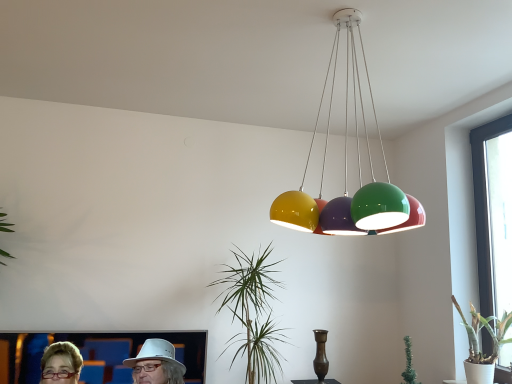
Question: In which direction should I rotate to look at green glossy plant at center, acting as the first houseplant starting from the left?

Choices:
 (A) left
 (B) right

Answer: (A)

Question: Does transparent glass window at right have a greater height compared to bronze metallic vase at center?

Choices:
 (A) yes
 (B) no

Answer: (A)

Question: Can you confirm if transparent glass window at right is thinner than bronze metallic vase at center?

Choices:
 (A) yes
 (B) no

Answer: (A)

Question: Is transparent glass window at right far away from bronze metallic vase at center?

Choices:
 (A) no
 (B) yes

Answer: (B)

Question: Does transparent glass window at right lie behind bronze metallic vase at center?

Choices:
 (A) no
 (B) yes

Answer: (A)

Question: Is transparent glass window at right outside bronze metallic vase at center?

Choices:
 (A) no
 (B) yes

Answer: (B)

Question: Is transparent glass window at right facing away from bronze metallic vase at center?

Choices:
 (A) no
 (B) yes

Answer: (A)

Question: Can you confirm if matte white hat at lower left is smaller than green glossy plant at center, acting as the first houseplant starting from the left?

Choices:
 (A) no
 (B) yes

Answer: (B)

Question: Are matte white hat at lower left and green glossy plant at center, which ranks as the 2th houseplant in right-to-left order, far apart?

Choices:
 (A) no
 (B) yes

Answer: (A)

Question: From the image's perspective, is matte white hat at lower left on top of green glossy plant at center, which ranks as the 2th houseplant in right-to-left order?

Choices:
 (A) no
 (B) yes

Answer: (A)

Question: Is matte white hat at lower left facing away from green glossy plant at center, acting as the first houseplant starting from the left?

Choices:
 (A) no
 (B) yes

Answer: (A)

Question: Can you confirm if matte white hat at lower left is bigger than green glossy plant at center, which ranks as the 2th houseplant in right-to-left order?

Choices:
 (A) yes
 (B) no

Answer: (B)

Question: Does matte white hat at lower left come behind green glossy plant at center, acting as the first houseplant starting from the left?

Choices:
 (A) no
 (B) yes

Answer: (A)

Question: Considering the relative positions of transparent glass window at right and matte white hat at lower left in the image provided, is transparent glass window at right to the right of matte white hat at lower left from the viewer's perspective?

Choices:
 (A) yes
 (B) no

Answer: (A)